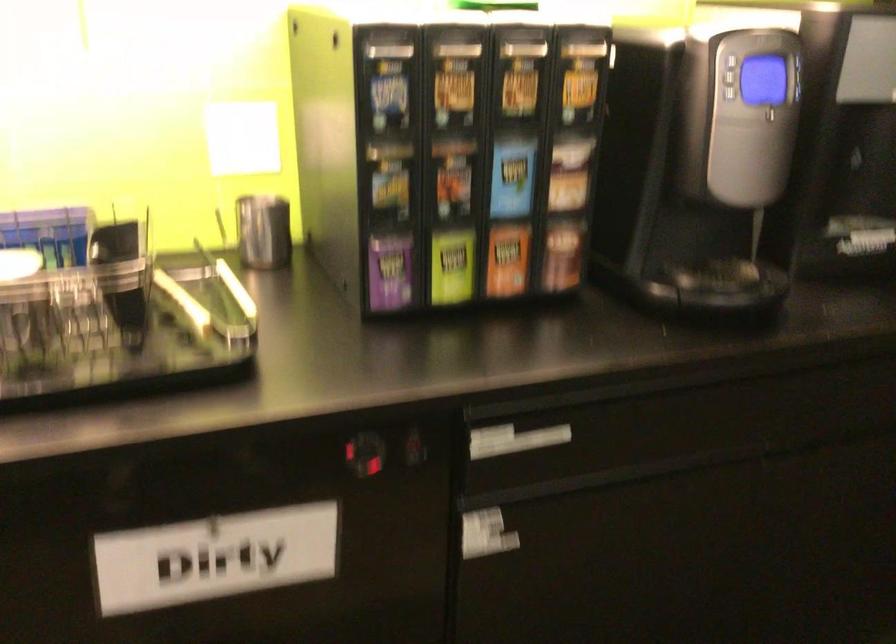
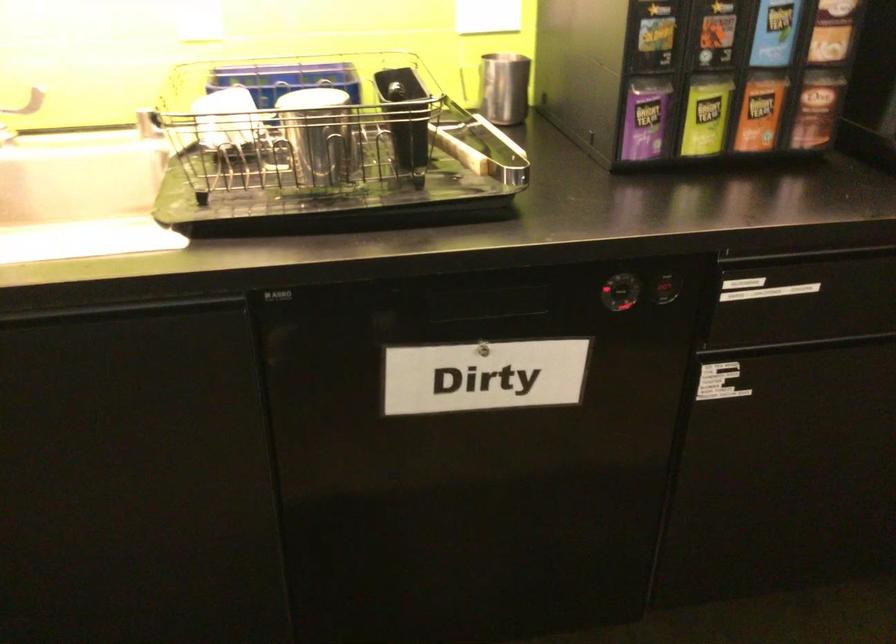
The point at [505,257] is marked in the first image. Where is the corresponding point in the second image?

(760, 111)